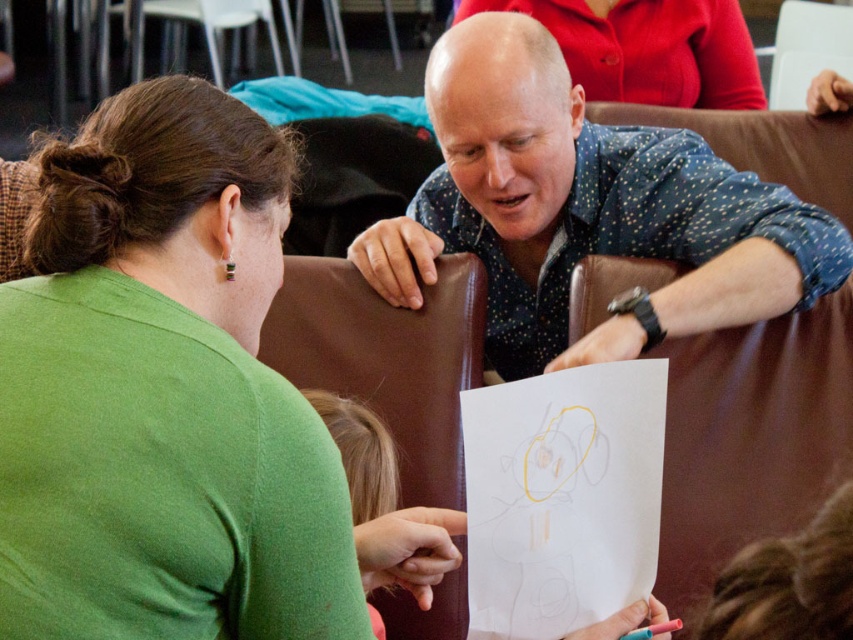
Does green matte shirt at upper left have a greater height compared to blue dotted shirt at upper center?

No.

Locate an element on the screen. green matte shirt at upper left is located at coordinates (161, 394).

Which is below, green matte shirt at upper left or blonde hair at lower center?

blonde hair at lower center

Which is behind, point (265, 140) or point (451, 525)?

The point (451, 525) is behind.

Image resolution: width=853 pixels, height=640 pixels. What do you see at coordinates (161, 394) in the screenshot?
I see `green matte shirt at upper left` at bounding box center [161, 394].

I want to click on green matte shirt at upper left, so click(x=161, y=394).

Between blue dotted shirt at upper center and blonde hair at lower center, which one is positioned lower?

blonde hair at lower center

Is blue dotted shirt at upper center to the left of blonde hair at lower center from the viewer's perspective?

Incorrect, blue dotted shirt at upper center is not on the left side of blonde hair at lower center.

Measure the distance between point (x=401, y=248) and camera.

Point (x=401, y=248) is 1.60 meters away from camera.

Find the location of a particular element. blue dotted shirt at upper center is located at coordinates (585, 211).